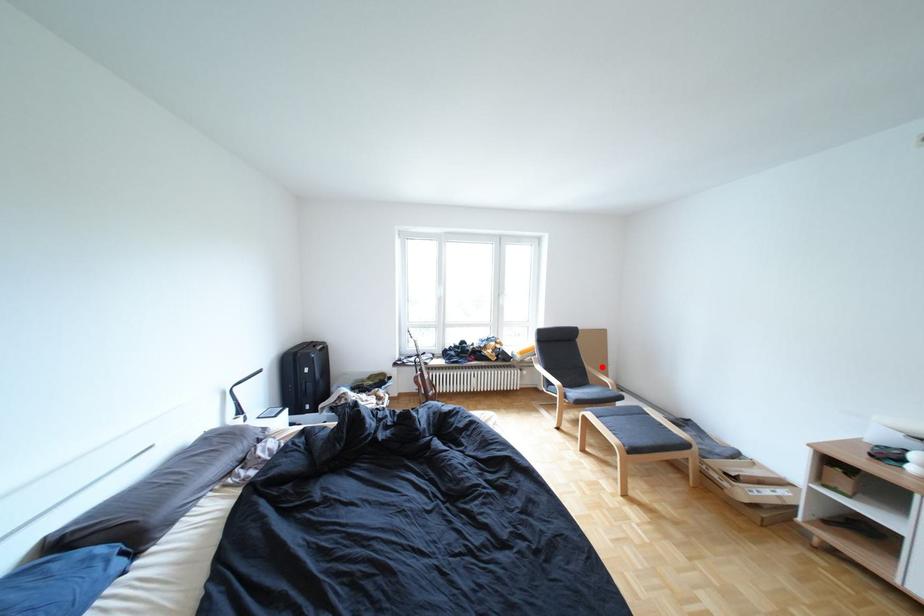
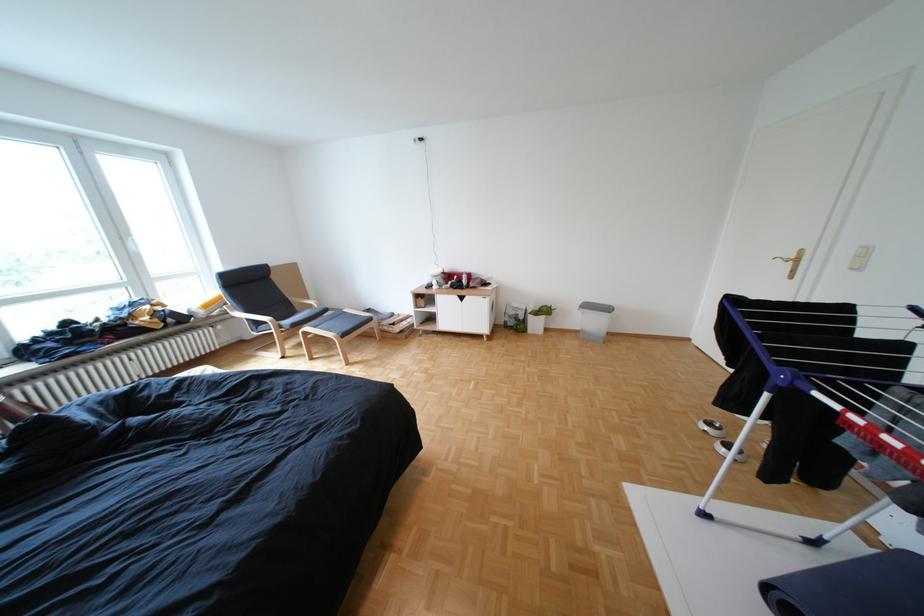
Question: I am providing you with two images of the same scene from different viewpoints. A red point is marked on the first image. At the location where the point appears in image 1, is it still visible in image 2?

Choices:
 (A) Yes
 (B) No

Answer: (A)